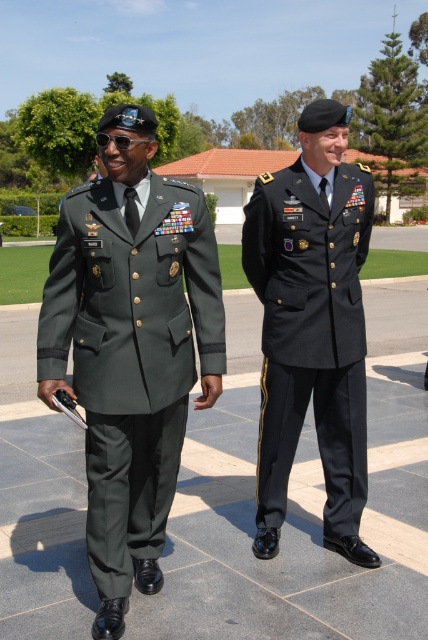
Question: Does green fabric uniform at left come in front of black matte uniform at center?

Choices:
 (A) no
 (B) yes

Answer: (B)

Question: Does green fabric uniform at left appear on the right side of black matte uniform at center?

Choices:
 (A) yes
 (B) no

Answer: (B)

Question: Which point appears farthest from the camera in this image?

Choices:
 (A) (62, 230)
 (B) (267, 250)

Answer: (B)

Question: Which point is farther to the camera?

Choices:
 (A) (59, 352)
 (B) (365, 339)

Answer: (B)

Question: Is green fabric uniform at left smaller than black matte uniform at center?

Choices:
 (A) yes
 (B) no

Answer: (A)